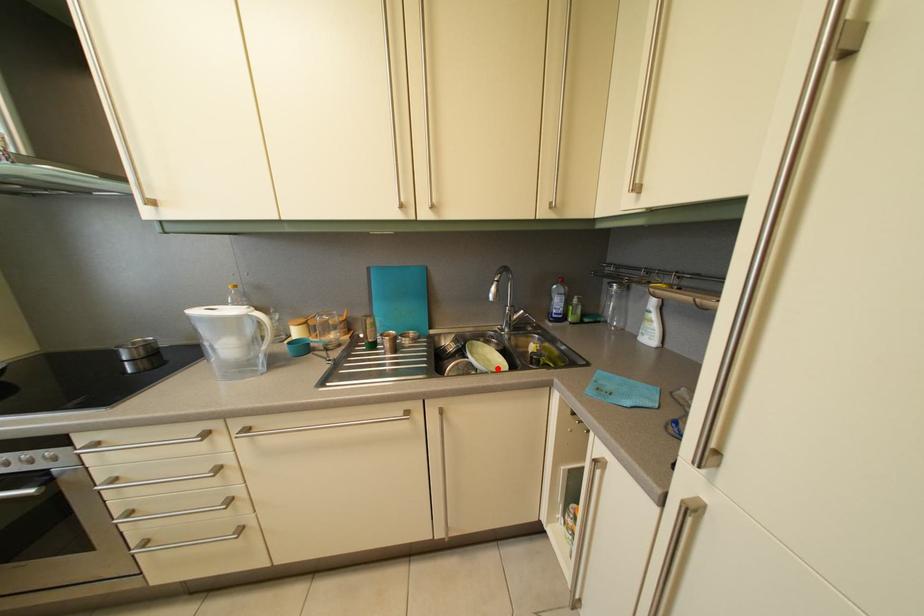
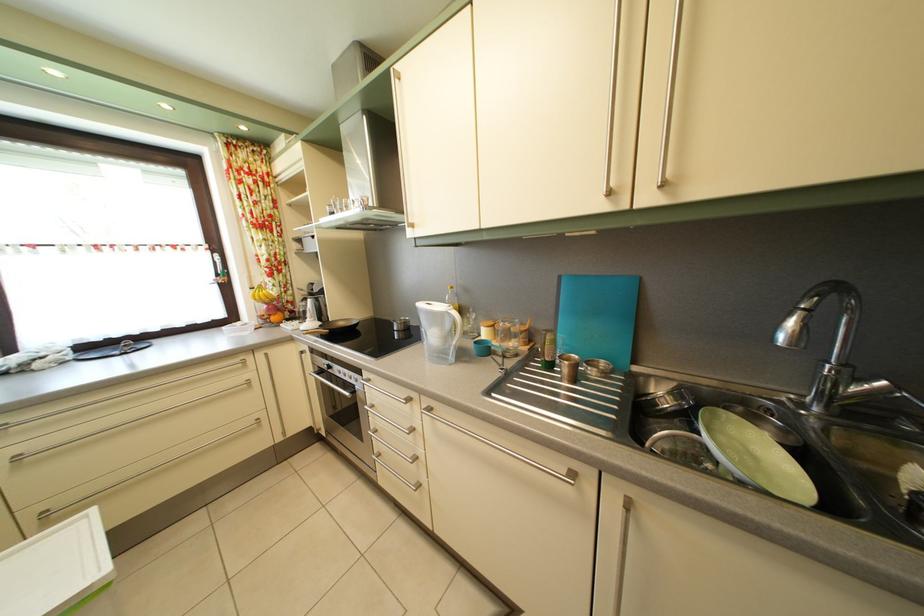
Locate, in the second image, the point that corresponds to the highlighted location in the first image.

(763, 466)